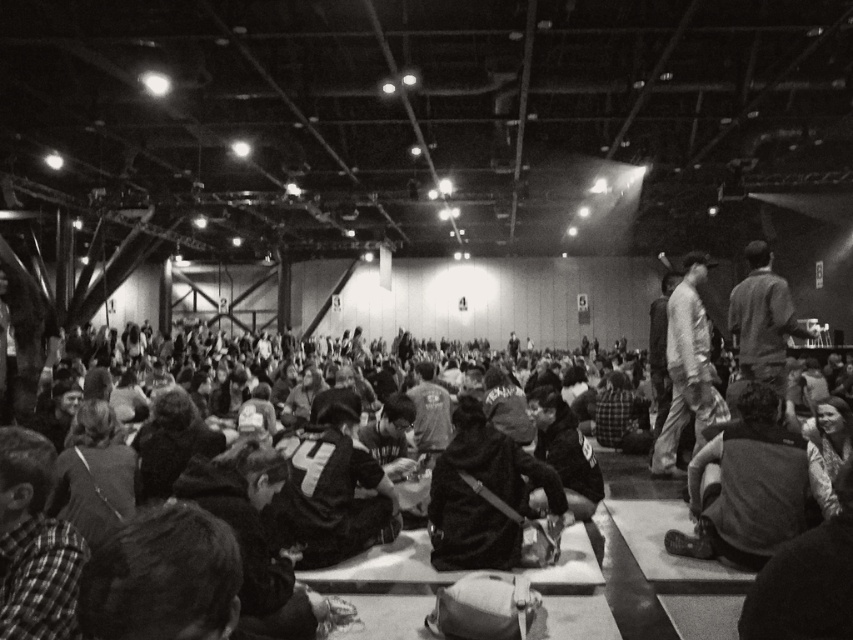
You are organizing a photo shoot in this venue and need to place two props on the floor. The dark gray hoodie at lower right and the dark gray fabric jacket at center must be positioned such that their combined width does not exceed 1.2 meters. Given their individual widths, is this arrangement possible?

The dark gray hoodie at lower right has a lesser width compared to the dark gray fabric jacket at center. Since the hoodie is narrower, their combined width could potentially be under 1.2 meters if placed side by side, but the exact feasibility depends on their specific measurements. However, since the hoodie is narrower than the jacket, arranging them side by side might allow the total width to stay within the limit if their combined dimensions are under 1.2 meters.

You are a photographer at this event and want to capture a photo that includes both the dark gray hoodie at lower right and the dark gray fabric jacket at center. Based on their positions, which object should you position closer to the right side of your camera frame?

The dark gray hoodie at lower right should be positioned closer to the right side of your camera frame since it is located to the right of the dark gray fabric jacket at center.